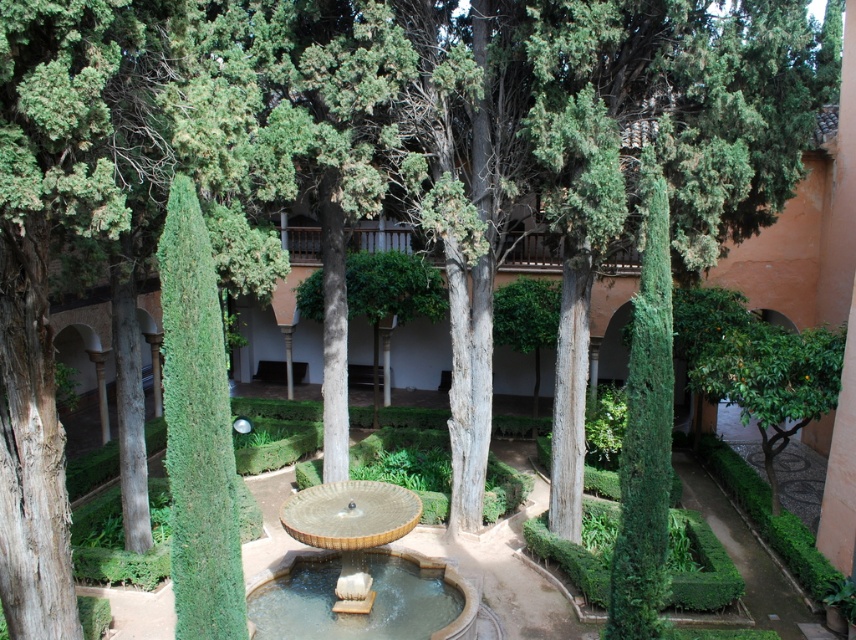
Question: Which point is farther from the camera taking this photo?

Choices:
 (A) (839, 349)
 (B) (289, 516)

Answer: (A)

Question: Does gold textured basin at center have a smaller size compared to green leafy tree at right?

Choices:
 (A) no
 (B) yes

Answer: (A)

Question: Is gold textured basin at center to the right of green leafy tree at right from the viewer's perspective?

Choices:
 (A) yes
 (B) no

Answer: (B)

Question: Is gold textured basin at center bigger than green leafy tree at right?

Choices:
 (A) yes
 (B) no

Answer: (A)